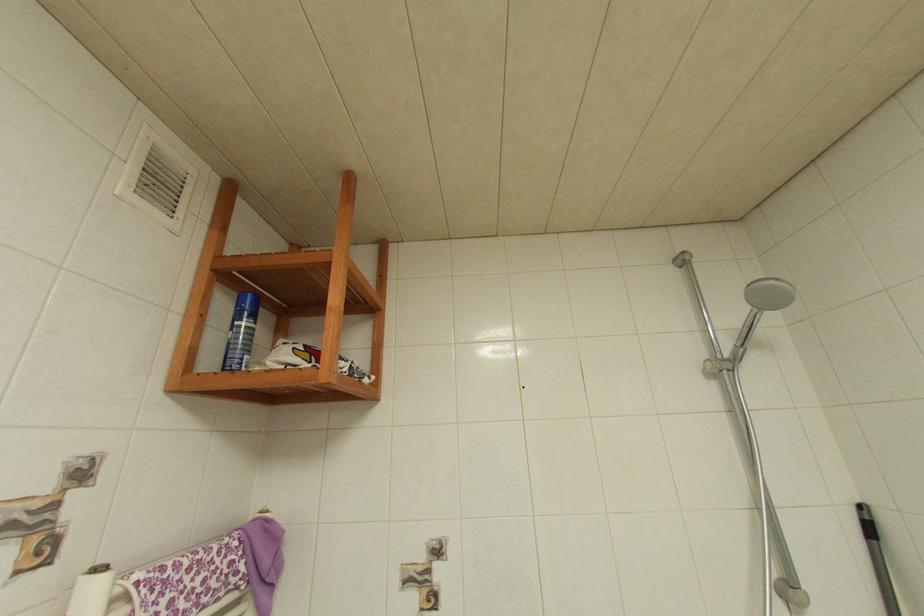
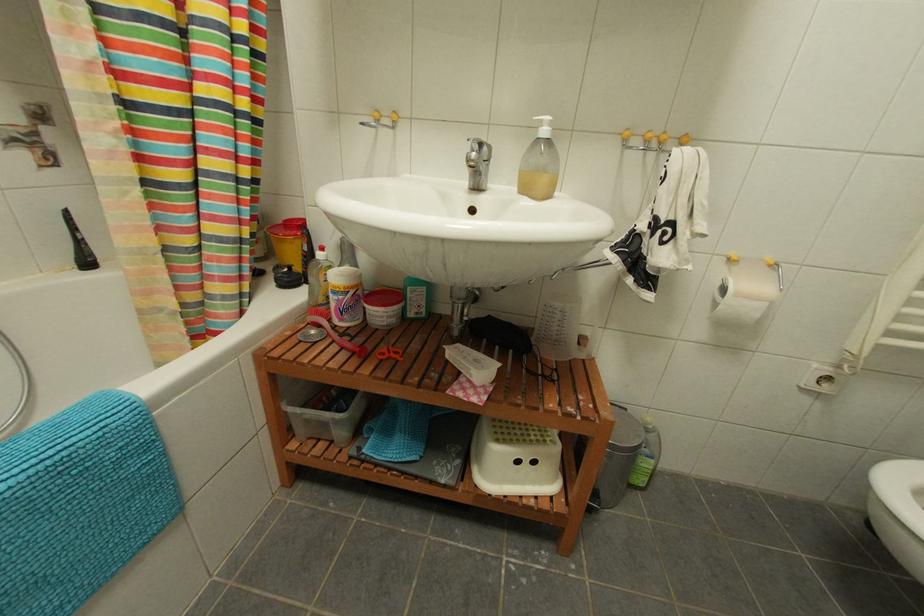
The images are taken continuously from a first-person perspective. In which direction is your viewpoint rotating?

The camera's rotation is toward left-down.